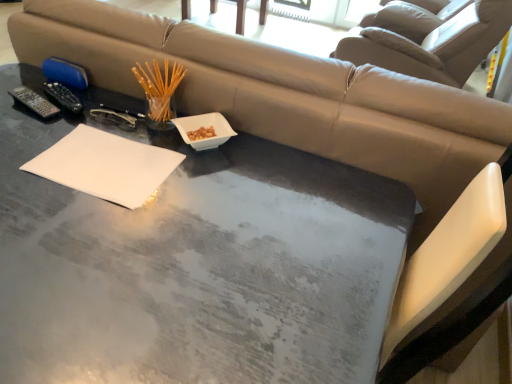
Question: Does wooden chair at upper center lie behind white ceramic bowl at center?

Choices:
 (A) yes
 (B) no

Answer: (A)

Question: Is wooden chair at upper center facing away from white ceramic bowl at center?

Choices:
 (A) yes
 (B) no

Answer: (B)

Question: Can you confirm if wooden chair at upper center is thinner than white ceramic bowl at center?

Choices:
 (A) yes
 (B) no

Answer: (B)

Question: Considering the relative sizes of wooden chair at upper center and white ceramic bowl at center in the image provided, is wooden chair at upper center wider than white ceramic bowl at center?

Choices:
 (A) no
 (B) yes

Answer: (B)

Question: Considering the relative positions of wooden chair at upper center and white ceramic bowl at center in the image provided, is wooden chair at upper center to the left of white ceramic bowl at center from the viewer's perspective?

Choices:
 (A) no
 (B) yes

Answer: (B)

Question: In terms of height, does wooden chair at upper center look taller or shorter compared to white ceramic bowl at center?

Choices:
 (A) short
 (B) tall

Answer: (B)

Question: In the image, is wooden chair at upper center on the left side or the right side of white ceramic bowl at center?

Choices:
 (A) left
 (B) right

Answer: (A)

Question: Considering the positions of wooden chair at upper center and white ceramic bowl at center in the image, is wooden chair at upper center bigger or smaller than white ceramic bowl at center?

Choices:
 (A) big
 (B) small

Answer: (A)

Question: Is wooden chair at upper center inside or outside of white ceramic bowl at center?

Choices:
 (A) outside
 (B) inside

Answer: (A)

Question: Based on their sizes in the image, would you say white ceramic bowl at center is bigger or smaller than black plastic remote at left?

Choices:
 (A) small
 (B) big

Answer: (B)

Question: In terms of width, does white ceramic bowl at center look wider or thinner when compared to black plastic remote at left?

Choices:
 (A) wide
 (B) thin

Answer: (A)

Question: Is white ceramic bowl at center spatially inside black plastic remote at left, or outside of it?

Choices:
 (A) inside
 (B) outside

Answer: (B)

Question: In the image, is white ceramic bowl at center positioned in front of or behind black plastic remote at left?

Choices:
 (A) front
 (B) behind

Answer: (A)

Question: Considering the relative positions of beige leather swivel chair at upper center and white matte notepad at center in the image provided, is beige leather swivel chair at upper center to the left or to the right of white matte notepad at center?

Choices:
 (A) right
 (B) left

Answer: (A)

Question: Considering the positions of point (353, 46) and point (51, 157), is point (353, 46) closer or farther from the camera than point (51, 157)?

Choices:
 (A) farther
 (B) closer

Answer: (A)